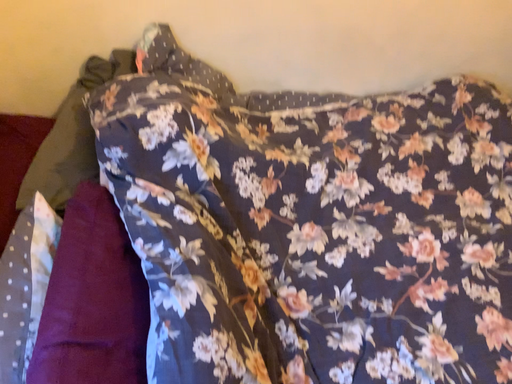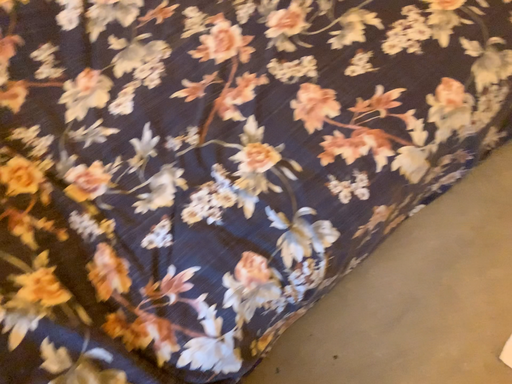
Question: How did the camera likely rotate when shooting the video?

Choices:
 (A) rotated downward
 (B) rotated upward

Answer: (A)